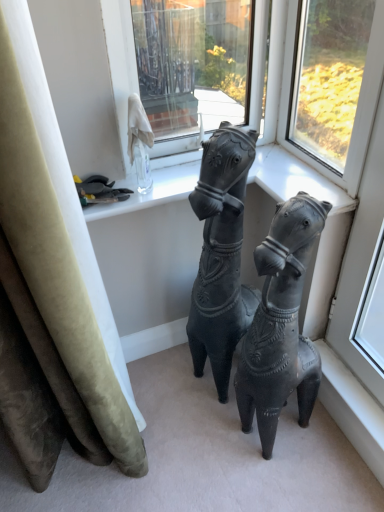
Question: From a real-world perspective, is transparent glass window at upper center, which is the first window in left-to-right order, on top of matte black horse at center?

Choices:
 (A) no
 (B) yes

Answer: (B)

Question: Is transparent glass window at upper center, marked as the second window in a right-to-left arrangement, behind matte black horse at center?

Choices:
 (A) yes
 (B) no

Answer: (A)

Question: From a real-world perspective, is transparent glass window at upper center, which is the first window in left-to-right order, under matte black horse at center?

Choices:
 (A) no
 (B) yes

Answer: (A)

Question: Is transparent glass window at upper center, which is the first window in left-to-right order, thinner than matte black horse at center?

Choices:
 (A) yes
 (B) no

Answer: (A)

Question: Considering the relative sizes of transparent glass window at upper center, marked as the second window in a right-to-left arrangement, and matte black horse at center in the image provided, is transparent glass window at upper center, marked as the second window in a right-to-left arrangement, shorter than matte black horse at center?

Choices:
 (A) no
 (B) yes

Answer: (B)

Question: Would you say matte black horse at center is inside or outside transparent glass window at upper center, marked as the second window in a left-to-right arrangement?

Choices:
 (A) outside
 (B) inside

Answer: (A)

Question: Is matte black horse at center in front of or behind transparent glass window at upper center, marked as the second window in a left-to-right arrangement, in the image?

Choices:
 (A) behind
 (B) front

Answer: (B)

Question: Visually, is matte black horse at center positioned to the left or to the right of transparent glass window at upper center, the first window positioned from the right?

Choices:
 (A) right
 (B) left

Answer: (B)

Question: In terms of height, does matte black horse at center look taller or shorter compared to transparent glass window at upper center, the first window positioned from the right?

Choices:
 (A) tall
 (B) short

Answer: (A)

Question: Looking at their shapes, would you say matte black horse at center is wider or thinner than transparent glass window at upper center, marked as the second window in a right-to-left arrangement?

Choices:
 (A) wide
 (B) thin

Answer: (A)

Question: From a real-world perspective, is matte black horse at center positioned above or below transparent glass window at upper center, marked as the second window in a right-to-left arrangement?

Choices:
 (A) below
 (B) above

Answer: (A)

Question: Based on their positions, is matte black horse at center located to the left or right of transparent glass window at upper center, which is the first window in left-to-right order?

Choices:
 (A) right
 (B) left

Answer: (A)

Question: From the image's perspective, relative to transparent glass window at upper center, marked as the second window in a right-to-left arrangement, is matte black horse at center above or below?

Choices:
 (A) above
 (B) below

Answer: (B)

Question: Would you say transparent glass window at upper center, marked as the second window in a right-to-left arrangement, is inside or outside transparent glass window at upper center, marked as the second window in a left-to-right arrangement?

Choices:
 (A) inside
 (B) outside

Answer: (B)

Question: Is transparent glass window at upper center, which is the first window in left-to-right order, wider or thinner than transparent glass window at upper center, marked as the second window in a left-to-right arrangement?

Choices:
 (A) thin
 (B) wide

Answer: (B)